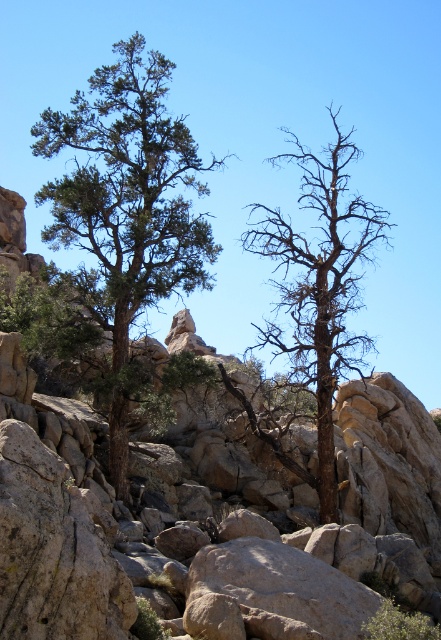
Question: Observing the image, what is the correct spatial positioning of green textured tree at center in reference to brown/dry wood tree at center?

Choices:
 (A) above
 (B) below

Answer: (A)

Question: Is the position of green textured tree at center more distant than that of brown/dry wood tree at center?

Choices:
 (A) yes
 (B) no

Answer: (A)

Question: Is green textured tree at center below brown/dry wood tree at center?

Choices:
 (A) no
 (B) yes

Answer: (A)

Question: Which object appears farthest from the camera in this image?

Choices:
 (A) brown/dry wood tree at center
 (B) green textured tree at center

Answer: (B)